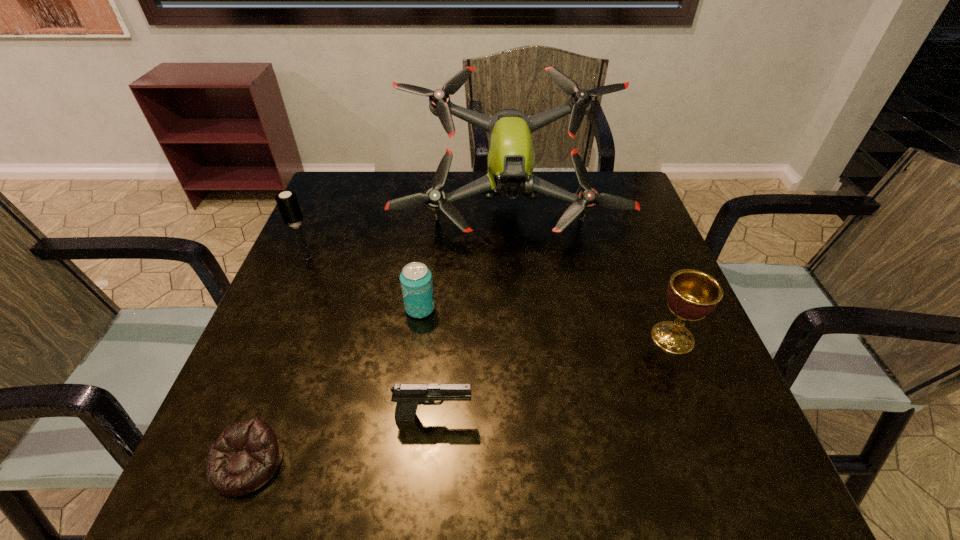
Identify the location of chalice that is at the right edge. The image size is (960, 540). pyautogui.click(x=691, y=294).

Image resolution: width=960 pixels, height=540 pixels. I want to click on object at the near left corner, so click(x=246, y=455).

Locate an element on the screen. object at the far right corner is located at coordinates (511, 159).

I want to click on free space at the far edge of the desktop, so [x=555, y=179].

You are a GUI agent. You are given a task and a screenshot of the screen. Output one action in this format:
    pyautogui.click(x=<x>, y=<y>)
    Task: Click on the vacant space at the near edge
    The width and height of the screenshot is (960, 540).
    Given the screenshot: What is the action you would take?
    pos(455,448)

Locate an element on the screen. Image resolution: width=960 pixels, height=540 pixels. free space at the left edge of the desktop is located at coordinates (313, 285).

You are a GUI agent. You are given a task and a screenshot of the screen. Output one action in this format:
    pyautogui.click(x=<x>, y=<y>)
    Task: Click on the vacant space at the right edge of the desktop
    Image resolution: width=960 pixels, height=540 pixels.
    Given the screenshot: What is the action you would take?
    pyautogui.click(x=615, y=303)

Image resolution: width=960 pixels, height=540 pixels. What are the coordinates of `free spot at the far left corner of the desktop` in the screenshot? It's located at (348, 192).

The width and height of the screenshot is (960, 540). I want to click on vacant space at the far right corner of the desktop, so click(600, 190).

Locate an element on the screen. The image size is (960, 540). free space at the near right corner of the desktop is located at coordinates (751, 473).